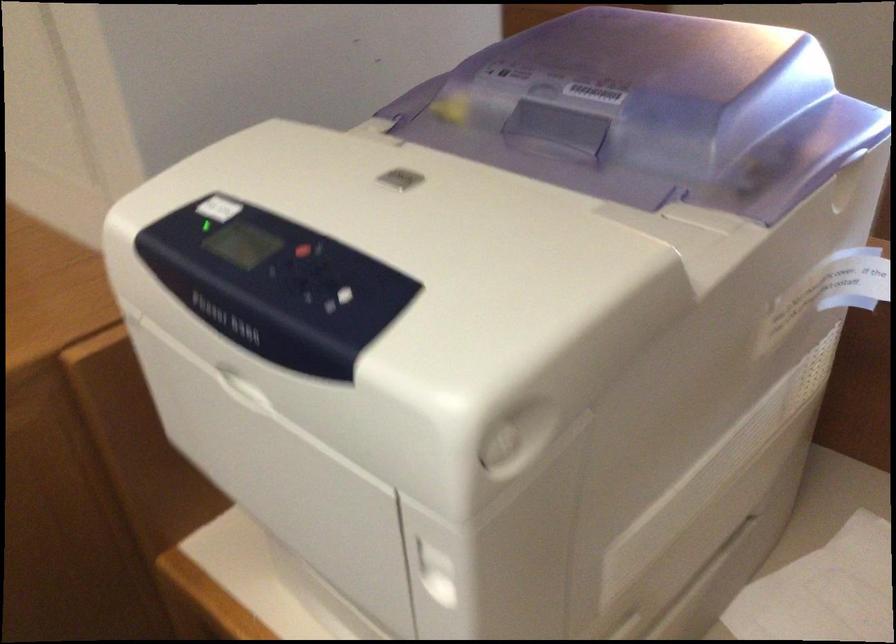
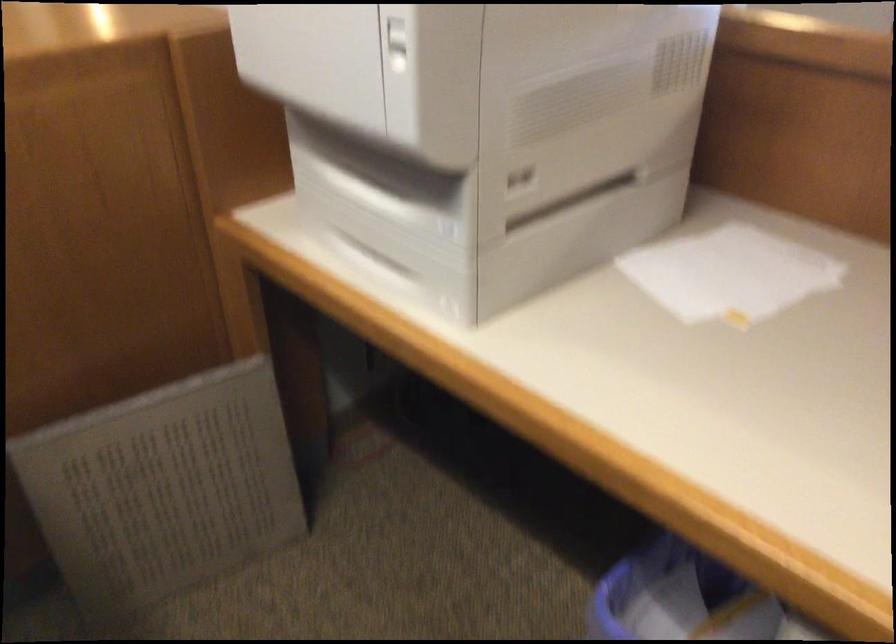
Which direction would the cameraman need to move to produce the second image?

The cameraman moved toward right, backward.